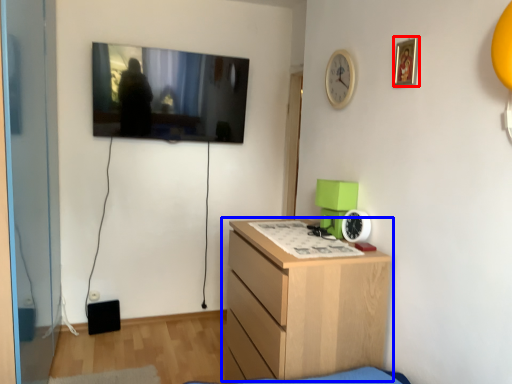
Question: Which object appears closest to the camera in this image, picture frame (highlighted by a red box) or chest of drawers (highlighted by a blue box)?

Choices:
 (A) picture frame
 (B) chest of drawers

Answer: (A)